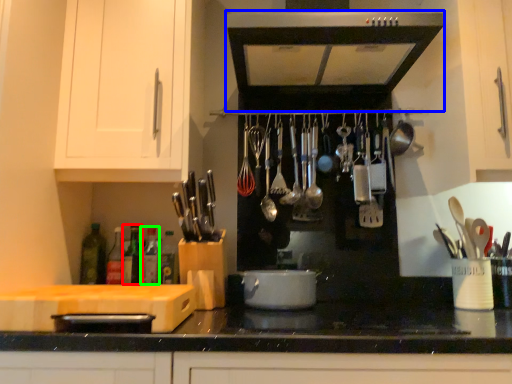
Question: Which object is positioned closest to bottle (highlighted by a red box)? Select from home appliance (highlighted by a blue box) and bottle (highlighted by a green box).

Choices:
 (A) home appliance
 (B) bottle

Answer: (B)